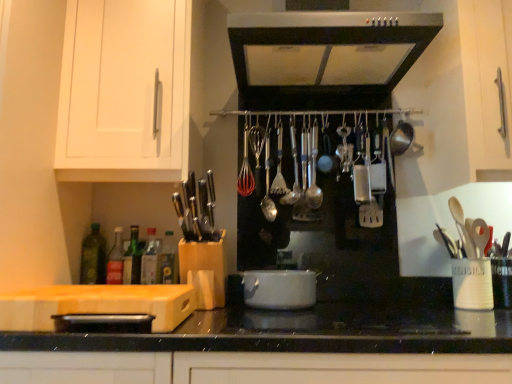
Question: Is point (314, 145) positioned closer to the camera than point (86, 258)?

Choices:
 (A) farther
 (B) closer

Answer: (A)

Question: From a real-world perspective, is satin silver spoon at center, placed as the 1th utensil when sorted from right to left, physically located above or below green glass bottle at left, the 1th bottle positioned from the left?

Choices:
 (A) above
 (B) below

Answer: (A)

Question: Which is farther from the silver metallic spoon at center, placed as the 1th utensil when sorted from left to right?

Choices:
 (A) translucent glass bottle at left, placed as the second bottle when sorted from left to right
 (B) translucent glass bottle at lower left, acting as the second bottle starting from the right
 (C) green glass bottle at lower left, marked as the 3th bottle in a right-to-left arrangement
 (D) satin silver range hood at upper center
 (E) green glass bottle at center, the 5th bottle in the left-to-right sequence

Answer: (A)

Question: Estimate the real-world distances between objects in this image. Which object is closer to the white matte cabinet at upper left?

Choices:
 (A) green glass bottle at center, the 5th bottle in the left-to-right sequence
 (B) white glossy pot at center
 (C) green glass bottle at left, arranged as the fifth bottle when viewed from the right
 (D) satin silver spoon at center, placed as the 1th utensil when sorted from right to left
 (E) translucent glass bottle at lower left, acting as the second bottle starting from the right

Answer: (C)